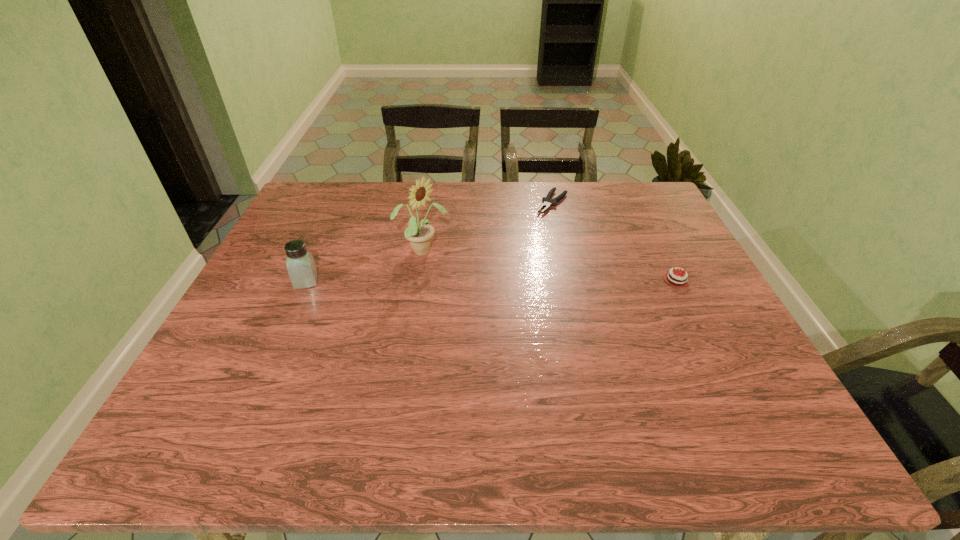
The image size is (960, 540). Find the location of `vacant position at the near edge of the desktop`. vacant position at the near edge of the desktop is located at coordinates (453, 378).

The width and height of the screenshot is (960, 540). What are the coordinates of `free space at the left edge of the desktop` in the screenshot? It's located at (264, 307).

The image size is (960, 540). I want to click on free region at the right edge, so click(x=665, y=226).

Identify the location of vacant region at the far left corner of the desktop. (343, 213).

Where is `free space at the near left corner of the desktop`? The width and height of the screenshot is (960, 540). free space at the near left corner of the desktop is located at coordinates (207, 387).

Where is `vacant region at the near right corner of the desktop`? The height and width of the screenshot is (540, 960). vacant region at the near right corner of the desktop is located at coordinates (766, 393).

At what (x,y) coordinates should I click in order to perform the action: click on empty space that is in between the leftmost object and the third tallest object. Please return your answer as a coordinate pair (x, y). This screenshot has width=960, height=540. Looking at the image, I should click on (492, 281).

Locate an element on the screen. The width and height of the screenshot is (960, 540). vacant area that lies between the second object from right to left and the rightmost object is located at coordinates (614, 241).

Find the location of a particular element. vacant area that lies between the chocolate cake and the tallest object is located at coordinates (549, 266).

Identify the location of vacant area between the shortest object and the third tallest object. (614, 241).